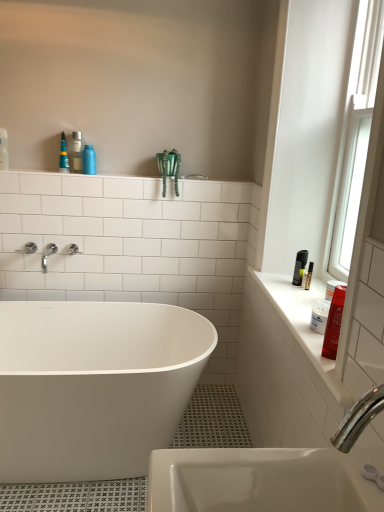
Locate an element on the screen. The image size is (384, 512). vacant point to the left of white glass window at right is located at coordinates (310, 276).